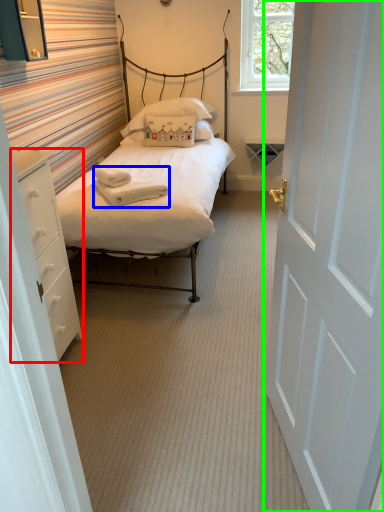
Question: Which is nearer to the nightstand (highlighted by a red box)? blanket (highlighted by a blue box) or door (highlighted by a green box).

Choices:
 (A) blanket
 (B) door

Answer: (A)